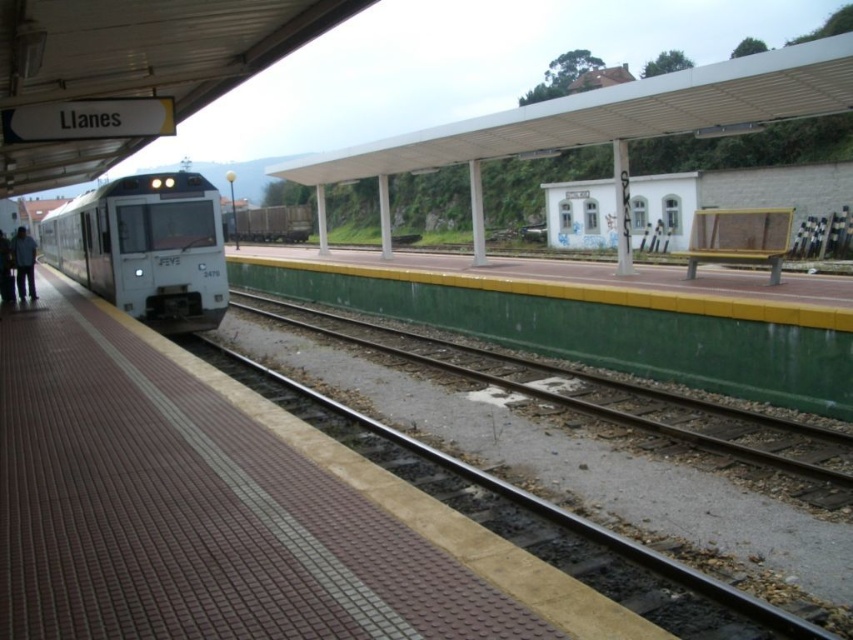
Question: Can you confirm if white glossy train at left is wider than dark blue jeans at left?

Choices:
 (A) yes
 (B) no

Answer: (B)

Question: Which object is positioned closest to the dark blue jeans at left?

Choices:
 (A) metal train track at center
 (B) brown wooden train at center
 (C) green concrete train track at center
 (D) dark gray jacket at left

Answer: (D)

Question: Is the position of brown wooden train at center less distant than that of dark blue jeans at left?

Choices:
 (A) yes
 (B) no

Answer: (B)

Question: Which point is closer to the camera taking this photo?

Choices:
 (A) (138, 202)
 (B) (608, 545)

Answer: (B)

Question: Can you confirm if white glossy train at left is positioned to the right of brown wooden train at center?

Choices:
 (A) yes
 (B) no

Answer: (A)

Question: Considering the real-world distances, which object is closest to the dark blue jeans at left?

Choices:
 (A) dark gray jacket at left
 (B) green concrete train track at center
 (C) metal train track at center
 (D) brown wooden train at center

Answer: (A)